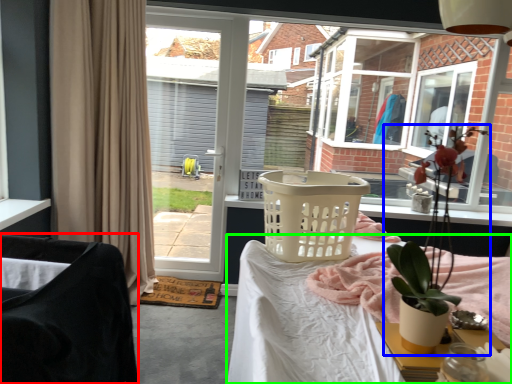
Question: Which object is positioned farthest from chair (highlighted by a red box)? Select from houseplant (highlighted by a blue box) and desk (highlighted by a green box).

Choices:
 (A) houseplant
 (B) desk

Answer: (A)